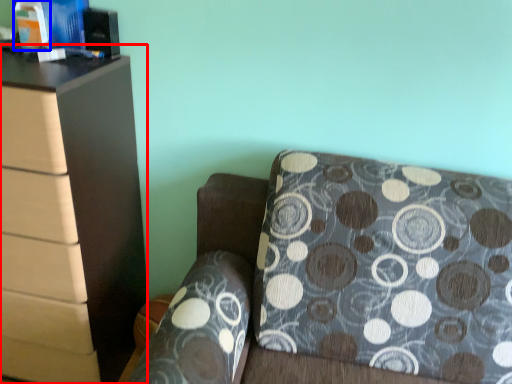
Question: Which object is further to the camera taking this photo, chest of drawers (highlighted by a red box) or book (highlighted by a blue box)?

Choices:
 (A) chest of drawers
 (B) book

Answer: (B)